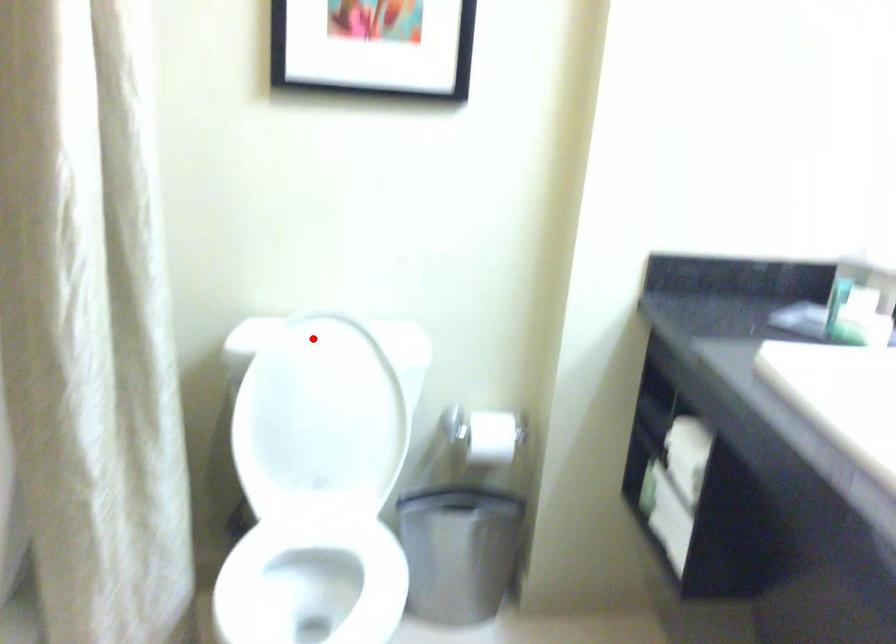
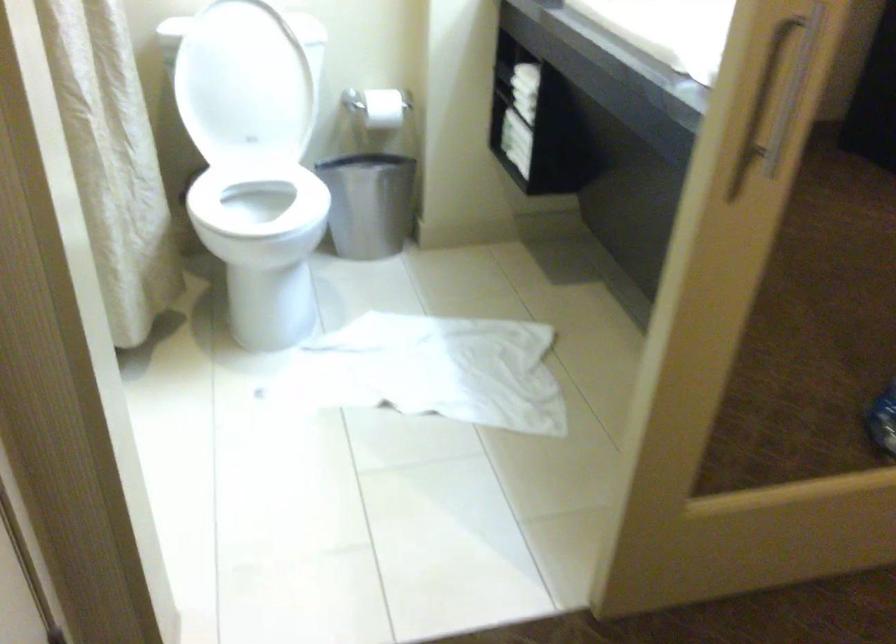
In the second image, find the point that corresponds to the highlighted location in the first image.

(231, 15)